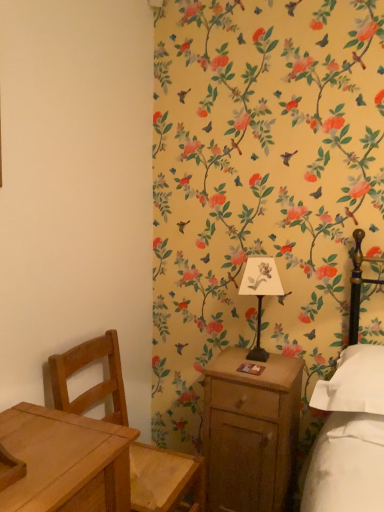
Question: Is the depth of wooden nightstand at right less than that of metallic black bedside lamp at center-right?

Choices:
 (A) no
 (B) yes

Answer: (B)

Question: Considering the relative positions of wooden nightstand at right and metallic black bedside lamp at center-right in the image provided, is wooden nightstand at right to the left of metallic black bedside lamp at center-right from the viewer's perspective?

Choices:
 (A) no
 (B) yes

Answer: (B)

Question: Is wooden nightstand at right at the right side of metallic black bedside lamp at center-right?

Choices:
 (A) yes
 (B) no

Answer: (B)

Question: Considering the relative sizes of wooden nightstand at right and metallic black bedside lamp at center-right in the image provided, is wooden nightstand at right wider than metallic black bedside lamp at center-right?

Choices:
 (A) no
 (B) yes

Answer: (B)

Question: Is wooden nightstand at right shorter than metallic black bedside lamp at center-right?

Choices:
 (A) yes
 (B) no

Answer: (B)

Question: Considering their positions, is metallic black bedside lamp at center-right located in front of or behind light brown wooden chair at left?

Choices:
 (A) front
 (B) behind

Answer: (B)

Question: Looking at their shapes, would you say metallic black bedside lamp at center-right is wider or thinner than light brown wooden chair at left?

Choices:
 (A) thin
 (B) wide

Answer: (A)

Question: Considering the relative positions of metallic black bedside lamp at center-right and light brown wooden chair at left in the image provided, is metallic black bedside lamp at center-right to the left or to the right of light brown wooden chair at left?

Choices:
 (A) left
 (B) right

Answer: (B)

Question: Would you say metallic black bedside lamp at center-right is inside or outside light brown wooden chair at left?

Choices:
 (A) inside
 (B) outside

Answer: (B)

Question: From a real-world perspective, is wooden nightstand at right positioned above or below light brown wooden chair at left?

Choices:
 (A) below
 (B) above

Answer: (A)

Question: Would you say wooden nightstand at right is to the left or to the right of light brown wooden chair at left in the picture?

Choices:
 (A) left
 (B) right

Answer: (B)

Question: Is wooden nightstand at right taller or shorter than light brown wooden chair at left?

Choices:
 (A) tall
 (B) short

Answer: (B)

Question: Would you say wooden nightstand at right is inside or outside light brown wooden chair at left?

Choices:
 (A) outside
 (B) inside

Answer: (A)

Question: From the image's perspective, is light brown wooden chair at left located above or below wooden nightstand at right?

Choices:
 (A) below
 (B) above

Answer: (B)

Question: Considering the positions of light brown wooden chair at left and wooden nightstand at right in the image, is light brown wooden chair at left wider or thinner than wooden nightstand at right?

Choices:
 (A) thin
 (B) wide

Answer: (B)